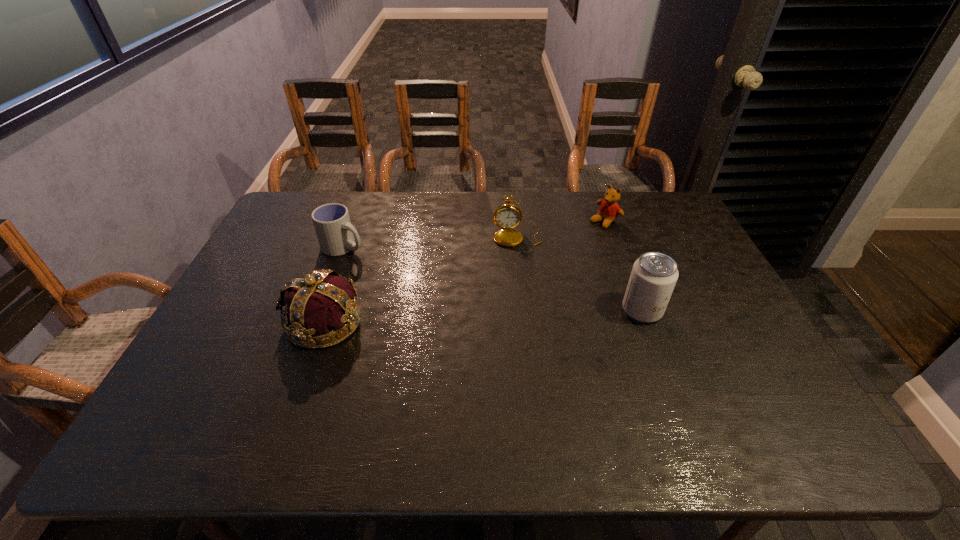
Find the location of a particular element. The width and height of the screenshot is (960, 540). vacant position at the left edge of the desktop is located at coordinates (228, 304).

Identify the location of vacant space at the right edge of the desktop. (652, 234).

In the image, there is a desktop. At what (x,y) coordinates should I click in order to perform the action: click on free region at the far right corner. Please return your answer as a coordinate pair (x, y). The image size is (960, 540). Looking at the image, I should click on (658, 197).

Locate an element on the screen. Image resolution: width=960 pixels, height=540 pixels. unoccupied position between the pocket watch and the cup is located at coordinates (431, 241).

The image size is (960, 540). In order to click on vacant space in between the cup and the third object from right to left in this screenshot , I will do `click(431, 241)`.

Where is `unoccupied position between the crown and the third object from right to left`? This screenshot has height=540, width=960. unoccupied position between the crown and the third object from right to left is located at coordinates (420, 279).

Locate an element on the screen. empty space that is in between the pocket watch and the crown is located at coordinates click(x=420, y=279).

This screenshot has width=960, height=540. Find the location of `empty location between the cup and the pocket watch`. empty location between the cup and the pocket watch is located at coordinates (431, 241).

Where is `free spot between the teddy bear and the soda can`? The width and height of the screenshot is (960, 540). free spot between the teddy bear and the soda can is located at coordinates (623, 266).

Find the location of `vacant region between the cup and the pocket watch`. vacant region between the cup and the pocket watch is located at coordinates (431, 241).